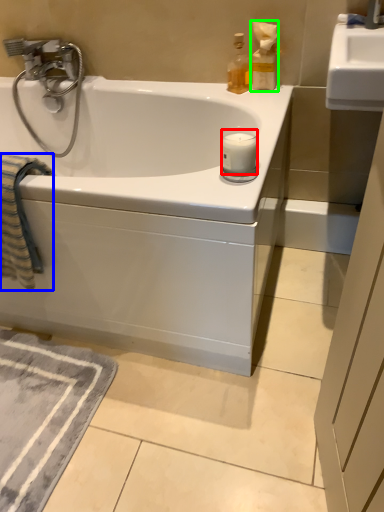
Question: Which object is the farthest from candle (highlighted by a red box)? Choose among these: beach towel (highlighted by a blue box) or bottle (highlighted by a green box).

Choices:
 (A) beach towel
 (B) bottle

Answer: (A)